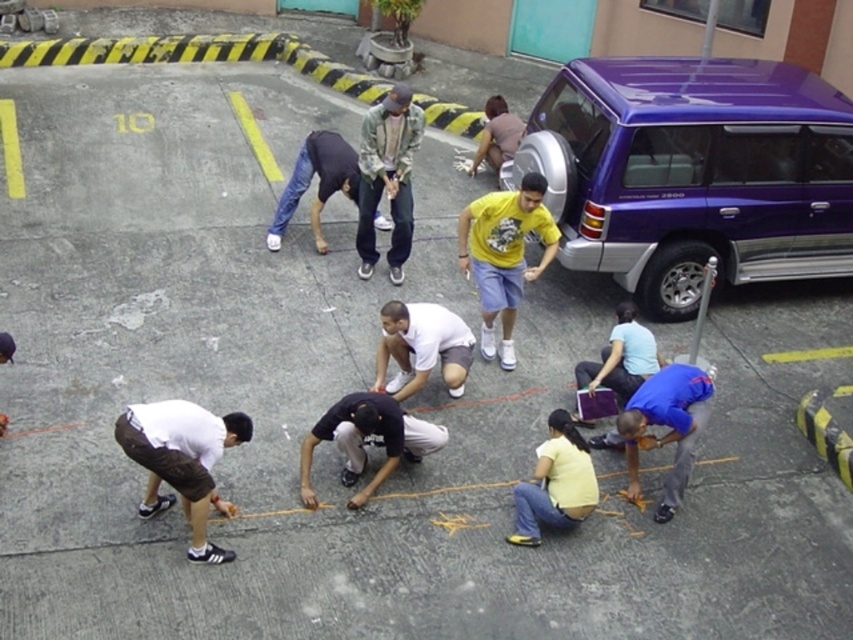
Who is shorter, black matte shirt at center or yellow matte shirt at lower center?

black matte shirt at center

Is black matte shirt at center wider than yellow matte shirt at lower center?

Yes.

This screenshot has height=640, width=853. Describe the element at coordinates (366, 435) in the screenshot. I see `black matte shirt at center` at that location.

The width and height of the screenshot is (853, 640). What are the coordinates of `black matte shirt at center` in the screenshot? It's located at (366, 435).

Is black matte shirt at center wider than white matte shirt at center?

Indeed, black matte shirt at center has a greater width compared to white matte shirt at center.

Where is `black matte shirt at center`? The height and width of the screenshot is (640, 853). black matte shirt at center is located at coordinates (366, 435).

Which is behind, point (364, 432) or point (432, 339)?

Positioned behind is point (432, 339).

Where is `black matte shirt at center`? The image size is (853, 640). black matte shirt at center is located at coordinates (366, 435).

Can you confirm if dark blue jeans at center is positioned to the left of light blue shirt at center?

Indeed, dark blue jeans at center is positioned on the left side of light blue shirt at center.

How distant is dark blue jeans at center from light blue shirt at center?

3.48 meters

At what (x,y) coordinates should I click in order to perform the action: click on dark blue jeans at center. Please return your answer as a coordinate pair (x, y). Looking at the image, I should click on (318, 182).

Where is `dark blue jeans at center`? dark blue jeans at center is located at coordinates (318, 182).